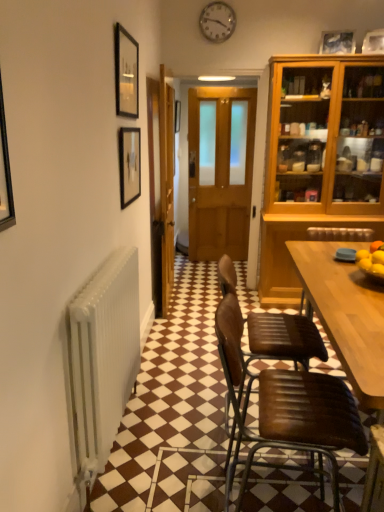
Find the location of a particular element. empty space that is ontop of wooden door at center, the 1th door from the right (from a real-world perspective) is located at coordinates (218, 57).